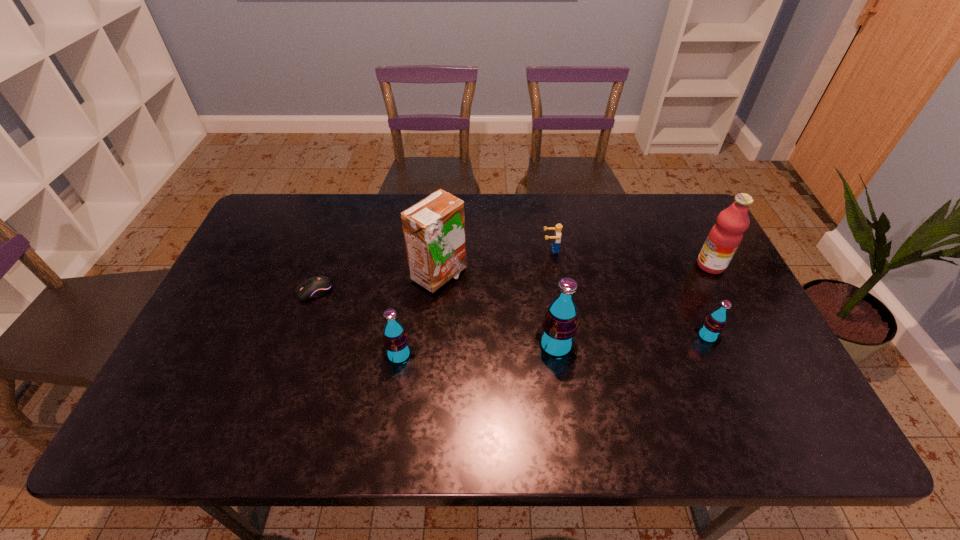
Locate an element on the screen. Image resolution: width=960 pixels, height=540 pixels. carton is located at coordinates (434, 229).

You are a GUI agent. You are given a task and a screenshot of the screen. Output one action in this format:
    pyautogui.click(x=<x>, y=<y>)
    Task: Click on the vacant region located on the right of the leftmost soda
    This screenshot has height=540, width=960.
    Given the screenshot: What is the action you would take?
    pyautogui.click(x=520, y=355)

This screenshot has height=540, width=960. I want to click on vacant region located on the back of the second soda from left to right, so click(x=542, y=254).

Where is `free space located on the left of the shortest soda`? free space located on the left of the shortest soda is located at coordinates (654, 336).

Image resolution: width=960 pixels, height=540 pixels. I want to click on vacant space situated 0.360m on the label of the fruit juice, so click(576, 265).

Identify the location of free space located on the label of the fruit juice. (646, 265).

Locate an element on the screen. vacant region located 0.110m on the label of the fruit juice is located at coordinates (660, 265).

Locate an element on the screen. vacant region located 0.310m on the back of the shortest object is located at coordinates (342, 214).

This screenshot has height=540, width=960. I want to click on free location located on the face of the second shortest object, so click(510, 249).

Where is `blank space located 0.220m on the face of the second shortest object`? blank space located 0.220m on the face of the second shortest object is located at coordinates (471, 249).